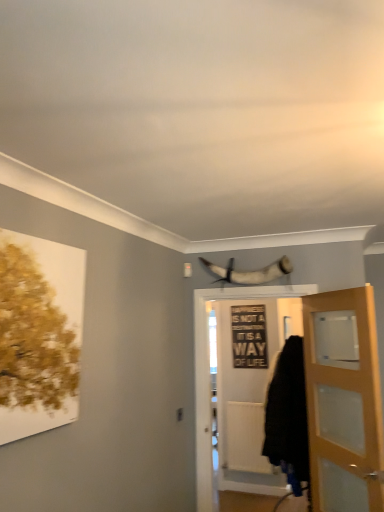
Question: Is white wooden door at center, positioned as the 2th door in right-to-left order, bigger or smaller than black fabric cloak at lower right?

Choices:
 (A) big
 (B) small

Answer: (B)

Question: Is point (205, 307) positioned closer to the camera than point (304, 468)?

Choices:
 (A) farther
 (B) closer

Answer: (A)

Question: Based on their relative distances, which object is farther from the light brown wooden door at right, the 1th door from the right?

Choices:
 (A) black fabric cloak at lower right
 (B) black matte sign at center
 (C) shiny silver horn at upper center
 (D) white wooden door at center, acting as the first door starting from the left

Answer: (B)

Question: Estimate the real-world distances between objects in this image. Which object is closer to the light brown wooden door at right, which ranks as the 2th door in left-to-right order?

Choices:
 (A) black matte sign at center
 (B) black fabric cloak at lower right
 (C) shiny silver horn at upper center
 (D) white wooden door at center, positioned as the 2th door in right-to-left order

Answer: (B)